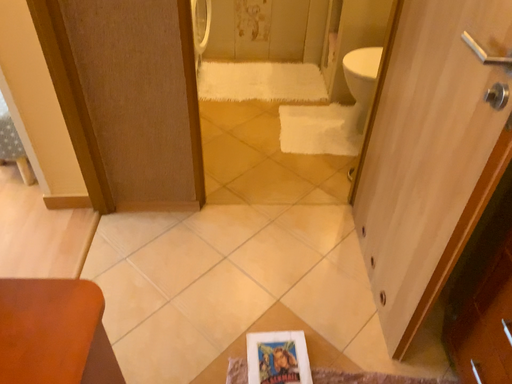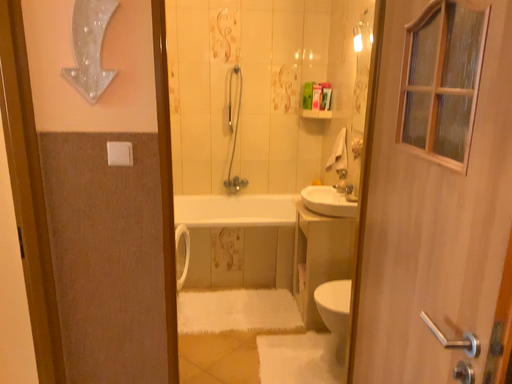
Question: Which way did the camera rotate in the video?

Choices:
 (A) rotated upward
 (B) rotated downward

Answer: (A)